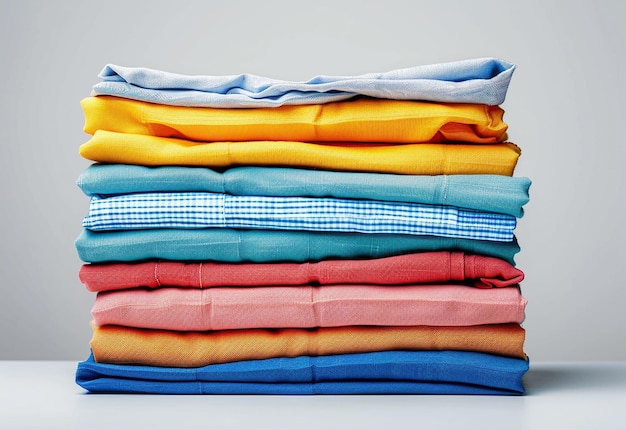
This screenshot has height=430, width=626. What are the coordinates of `folded clothing` in the screenshot? It's located at (255, 92), (253, 124), (252, 176), (250, 219), (244, 244), (245, 274), (245, 304), (242, 348), (245, 387).